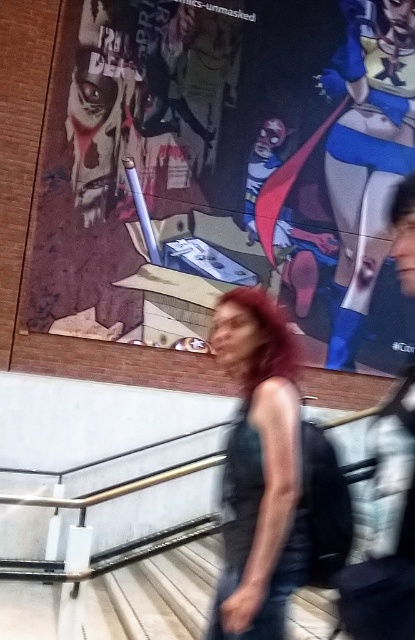
Between matte paper poster at upper center and wooden stairs at lower center, which one appears on the right side from the viewer's perspective?

Positioned to the right is matte paper poster at upper center.

Who is positioned more to the left, matte paper poster at upper center or wooden stairs at lower center?

From the viewer's perspective, wooden stairs at lower center appears more on the left side.

Describe the element at coordinates (226, 172) in the screenshot. I see `matte paper poster at upper center` at that location.

You are a GUI agent. You are given a task and a screenshot of the screen. Output one action in this format:
    pyautogui.click(x=<x>, y=<y>)
    Task: Click on the matte paper poster at upper center
    Image resolution: width=415 pixels, height=640 pixels.
    Given the screenshot: What is the action you would take?
    pyautogui.click(x=226, y=172)

Who is more forward, (x=283, y=509) or (x=195, y=556)?

Point (x=283, y=509) is more forward.

Does matte black tank top at center have a lesser width compared to wooden stairs at lower center?

Indeed, matte black tank top at center has a lesser width compared to wooden stairs at lower center.

Is point (282, 477) more distant than point (154, 588)?

No.

Identify the location of matte black tank top at center. (258, 468).

Is matte paper poster at upper center thinner than matte black tank top at center?

Incorrect, matte paper poster at upper center's width is not less than matte black tank top at center's.

Is matte paper poster at upper center wider than matte black tank top at center?

Yes, matte paper poster at upper center is wider than matte black tank top at center.

Is point (283, 284) more distant than point (288, 465)?

Yes, point (283, 284) is behind point (288, 465).

Find the location of a particular element. The height and width of the screenshot is (640, 415). matte paper poster at upper center is located at coordinates (226, 172).